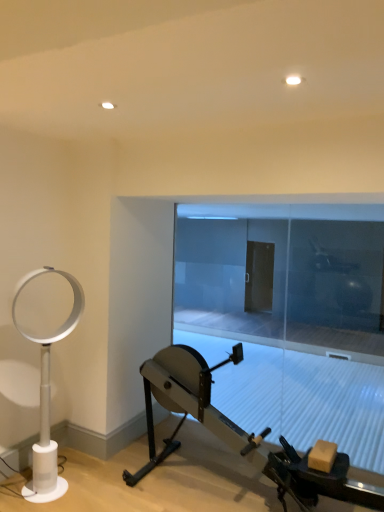
Locate an element on the screen. The image size is (384, 512). free location to the right of white plastic fan at left is located at coordinates (110, 478).